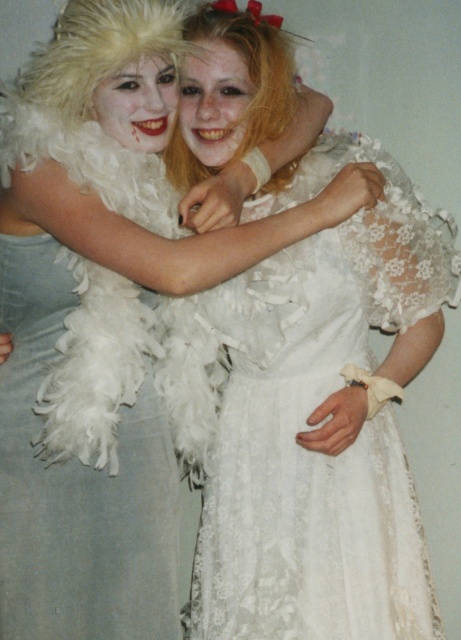
Is lace white dress at center behind blonde feather boa at upper center?

No, lace white dress at center is closer to the viewer.

Can you confirm if lace white dress at center is thinner than blonde feather boa at upper center?

Incorrect, lace white dress at center's width is not less than blonde feather boa at upper center's.

Between point (271, 413) and point (250, 51), which one is positioned in front?

Positioned in front is point (250, 51).

Identify the location of lace white dress at center. The height and width of the screenshot is (640, 461). (306, 422).

Based on the photo, can you confirm if lace white dress at center is positioned to the left of white feather boa at left?

No, lace white dress at center is not to the left of white feather boa at left.

Which is above, lace white dress at center or white feather boa at left?

lace white dress at center is above.

This screenshot has width=461, height=640. I want to click on lace white dress at center, so click(306, 422).

Locate an element on the screen. This screenshot has height=640, width=461. lace white dress at center is located at coordinates (306, 422).

Between white feather boa at left and blonde feather boa at upper center, which one appears on the left side from the viewer's perspective?

white feather boa at left is more to the left.

Consider the image. Which is more to the right, white feather boa at left or blonde feather boa at upper center?

From the viewer's perspective, blonde feather boa at upper center appears more on the right side.

I want to click on white feather boa at left, so click(76, 486).